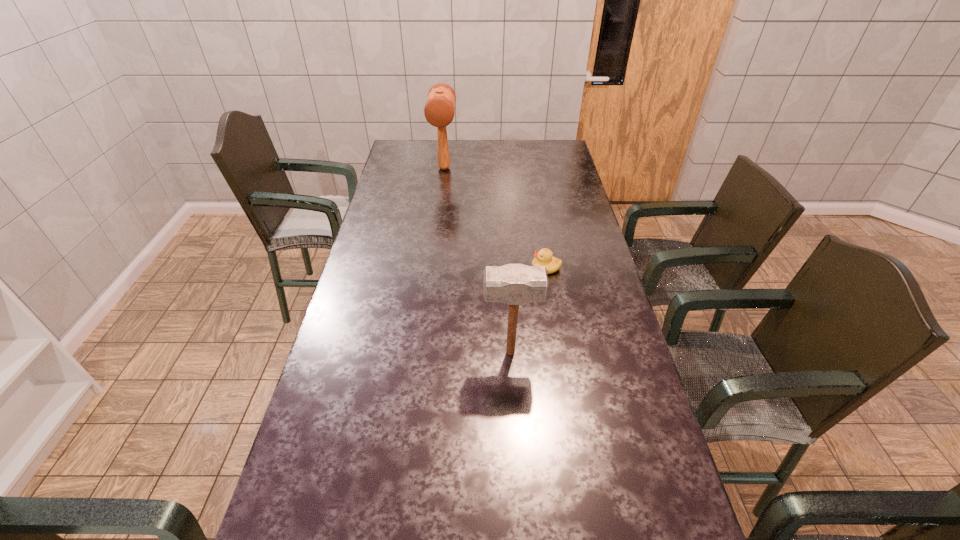
Where is `vacant area situated at the face of the rightmost object`? vacant area situated at the face of the rightmost object is located at coordinates (433, 267).

The height and width of the screenshot is (540, 960). I want to click on vacant space situated at the face of the rightmost object, so click(517, 267).

Find the location of a particular element. vacant point located at the face of the rightmost object is located at coordinates [x=485, y=267].

Where is `object at the far edge`? This screenshot has width=960, height=540. object at the far edge is located at coordinates (439, 111).

Find the location of a particular element. Image resolution: width=960 pixels, height=540 pixels. object that is at the right edge is located at coordinates (544, 257).

In the image, there is a desktop. Where is `blank space at the far edge`? The width and height of the screenshot is (960, 540). blank space at the far edge is located at coordinates (452, 159).

Find the location of a particular element. The height and width of the screenshot is (540, 960). free space at the left edge of the desktop is located at coordinates tap(377, 357).

Identify the location of vacant space at the right edge. The image size is (960, 540). (637, 441).

Locate an element on the screen. This screenshot has height=540, width=960. unoccupied position between the nearest object and the farthest object is located at coordinates (477, 260).

Where is `blank region between the second farthest object and the left mallet`? This screenshot has height=540, width=960. blank region between the second farthest object and the left mallet is located at coordinates (495, 218).